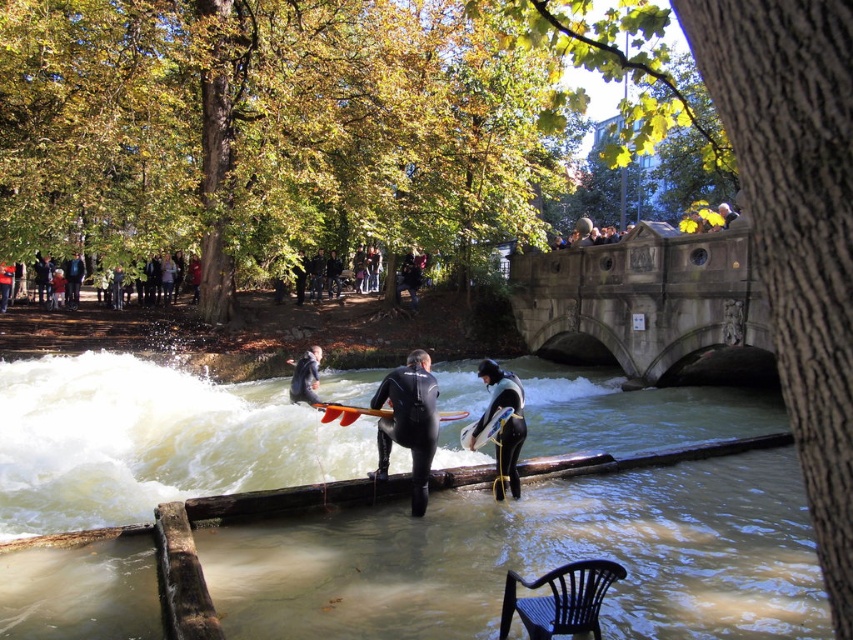
Is point (763, 342) positioned behind point (291, 401)?

That is False.

Who is shorter, stone bridge at center or black wetsuit surfer at center?

With less height is black wetsuit surfer at center.

Which is in front, point (666, 234) or point (300, 381)?

Point (300, 381) is more forward.

Find the location of a particular element. The width and height of the screenshot is (853, 640). stone bridge at center is located at coordinates (648, 305).

Which is more to the right, black plastic chair at lower center or white foam surfboard at center?

black plastic chair at lower center is more to the right.

Describe the element at coordinates (560, 600) in the screenshot. The width and height of the screenshot is (853, 640). I see `black plastic chair at lower center` at that location.

You are a GUI agent. You are given a task and a screenshot of the screen. Output one action in this format:
    pyautogui.click(x=<x>, y=<y>)
    Task: Click on the black plastic chair at lower center
    This screenshot has width=853, height=640.
    Given the screenshot: What is the action you would take?
    pyautogui.click(x=560, y=600)

Is black matte wetsuit at center above black neoprene wetsuit at lower center?

Correct, black matte wetsuit at center is located above black neoprene wetsuit at lower center.

Does black matte wetsuit at center lie in front of black neoprene wetsuit at lower center?

Yes, black matte wetsuit at center is closer to the viewer.

Locate an element on the screen. black matte wetsuit at center is located at coordinates (409, 420).